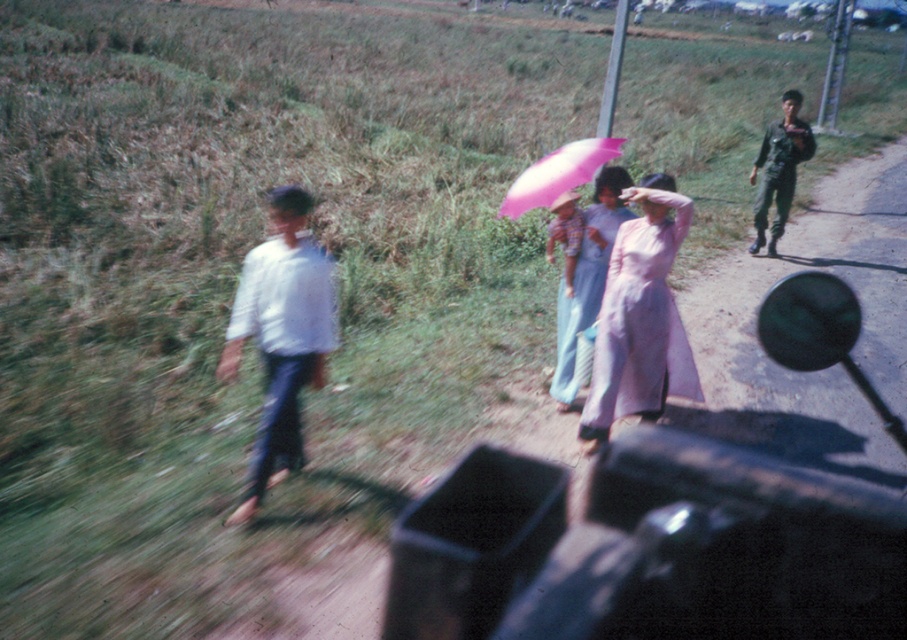
Does pink fabric dress at center appear over pink matte umbrella at center?

Actually, pink fabric dress at center is below pink matte umbrella at center.

Is pink fabric dress at center to the left of pink matte umbrella at center from the viewer's perspective?

In fact, pink fabric dress at center is to the right of pink matte umbrella at center.

At what (x,y) coordinates should I click in order to perform the action: click on pink fabric dress at center. Please return your answer as a coordinate pair (x, y). The width and height of the screenshot is (907, 640). Looking at the image, I should click on pos(587,276).

You are a GUI agent. You are given a task and a screenshot of the screen. Output one action in this format:
    pyautogui.click(x=<x>, y=<y>)
    Task: Click on the pink fabric dress at center
    The width and height of the screenshot is (907, 640).
    Given the screenshot: What is the action you would take?
    pyautogui.click(x=587, y=276)

Does pale pink silk ao dai at center have a smaller size compared to pink fabric dress at center?

Actually, pale pink silk ao dai at center might be larger than pink fabric dress at center.

Who is more distant from viewer, (586, 435) or (551, 234)?

The point (551, 234) is behind.

This screenshot has width=907, height=640. I want to click on pale pink silk ao dai at center, so click(640, 317).

Is pink fabric dress at center below dark green uniform at right?

Correct, pink fabric dress at center is located below dark green uniform at right.

Does pink fabric dress at center have a lesser height compared to dark green uniform at right?

Yes.

Between point (581, 291) and point (757, 156), which one is positioned behind?

The point (757, 156) is behind.

Locate an element on the screen. pink fabric dress at center is located at coordinates (587, 276).